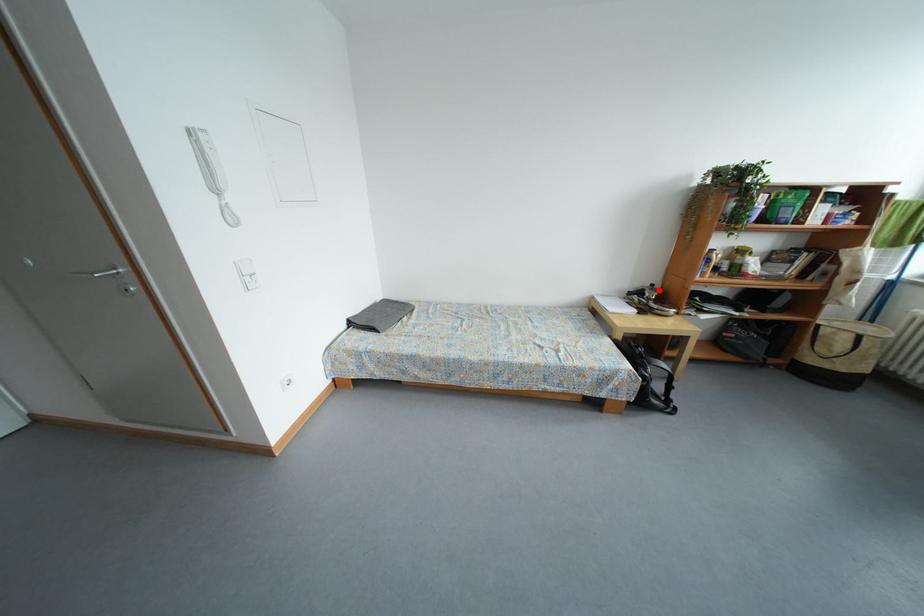
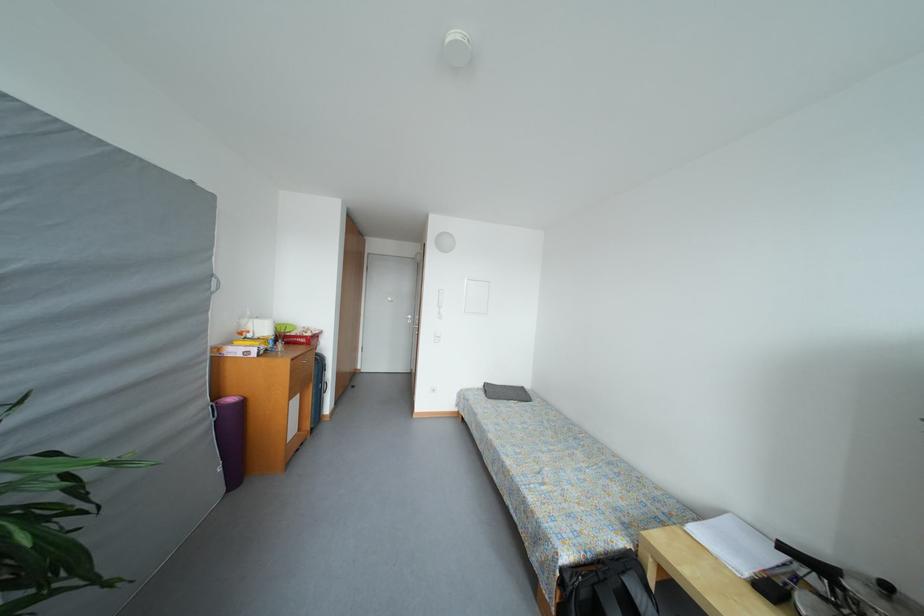
Question: I am providing you with two images of the same scene from different viewpoints. Given a red point in image1, look at the same physical point in image2. Is it:

Choices:
 (A) Closer to the viewpoint
 (B) Farther from the viewpoint

Answer: (B)